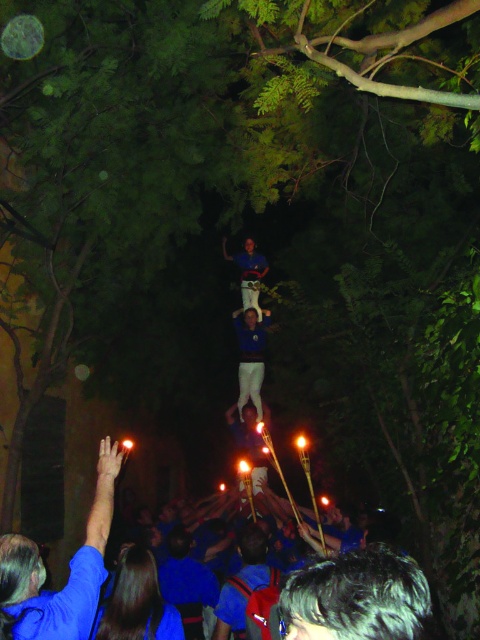
Can you confirm if blue fabric hand at lower left is bigger than blue fabric shirt at center?

Yes.

Which of these two, blue fabric hand at lower left or blue fabric shirt at center, stands taller?

blue fabric shirt at center is taller.

Image resolution: width=480 pixels, height=640 pixels. Describe the element at coordinates (69, 573) in the screenshot. I see `blue fabric hand at lower left` at that location.

Find the location of a particular element. Image resolution: width=480 pixels, height=640 pixels. blue fabric hand at lower left is located at coordinates (69, 573).